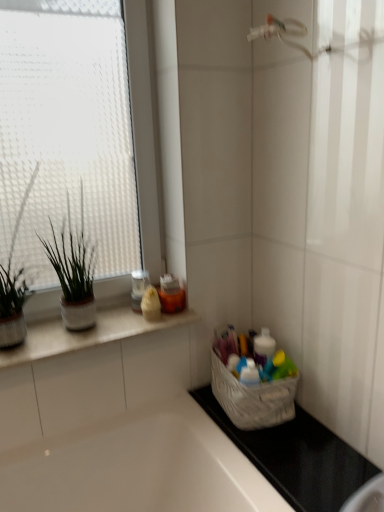
Question: Considering the relative sizes of green matte plant at left, which is counted as the 1th houseplant, starting from the left, and white fabric basket at lower right in the image provided, is green matte plant at left, which is counted as the 1th houseplant, starting from the left, wider than white fabric basket at lower right?

Choices:
 (A) yes
 (B) no

Answer: (B)

Question: From the image's perspective, is green matte plant at left, which is the second houseplant from right to left, over white fabric basket at lower right?

Choices:
 (A) yes
 (B) no

Answer: (A)

Question: Is green matte plant at left, which is the second houseplant from right to left, at the left side of white fabric basket at lower right?

Choices:
 (A) no
 (B) yes

Answer: (B)

Question: Can you confirm if green matte plant at left, which is the second houseplant from right to left, is shorter than white fabric basket at lower right?

Choices:
 (A) yes
 (B) no

Answer: (B)

Question: Looking at the image, does white fabric basket at lower right seem bigger or smaller compared to transparent glass window at upper left?

Choices:
 (A) small
 (B) big

Answer: (A)

Question: Is point (261, 424) closer or farther from the camera than point (119, 148)?

Choices:
 (A) farther
 (B) closer

Answer: (B)

Question: Is white fabric basket at lower right in front of or behind transparent glass window at upper left in the image?

Choices:
 (A) behind
 (B) front

Answer: (A)

Question: Considering the positions of white fabric basket at lower right and transparent glass window at upper left in the image, is white fabric basket at lower right wider or thinner than transparent glass window at upper left?

Choices:
 (A) thin
 (B) wide

Answer: (B)

Question: Is point (182, 417) positioned closer to the camera than point (91, 280)?

Choices:
 (A) closer
 (B) farther

Answer: (A)

Question: Is white glossy bathtub at lower left bigger or smaller than green matte plant at left, which is counted as the second houseplant, starting from the left?

Choices:
 (A) big
 (B) small

Answer: (A)

Question: In terms of width, does white glossy bathtub at lower left look wider or thinner when compared to green matte plant at left, which ranks as the 1th houseplant in right-to-left order?

Choices:
 (A) thin
 (B) wide

Answer: (B)

Question: From the image's perspective, is white glossy bathtub at lower left located above or below green matte plant at left, which ranks as the 1th houseplant in right-to-left order?

Choices:
 (A) below
 (B) above

Answer: (A)

Question: Would you say black rubber mat at lower right is to the left or to the right of green matte plant at left, which ranks as the 1th houseplant in right-to-left order, in the picture?

Choices:
 (A) left
 (B) right

Answer: (B)

Question: From a real-world perspective, relative to green matte plant at left, which ranks as the 1th houseplant in right-to-left order, is black rubber mat at lower right vertically above or below?

Choices:
 (A) above
 (B) below

Answer: (B)